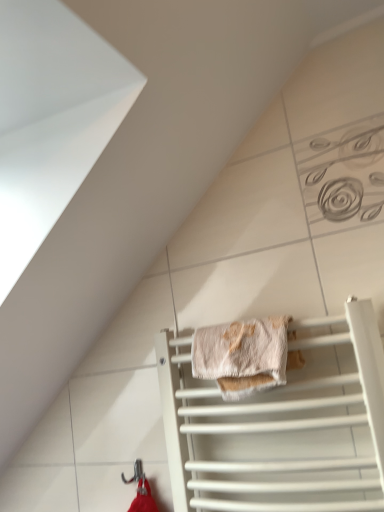
Question: Can you confirm if metallic hook at lower center is positioned to the left of beige textured towel at center?

Choices:
 (A) yes
 (B) no

Answer: (A)

Question: Considering the relative positions of metallic hook at lower center and beige textured towel at center in the image provided, is metallic hook at lower center to the right of beige textured towel at center from the viewer's perspective?

Choices:
 (A) no
 (B) yes

Answer: (A)

Question: From a real-world perspective, is metallic hook at lower center on beige textured towel at center?

Choices:
 (A) no
 (B) yes

Answer: (A)

Question: Does metallic hook at lower center have a lesser height compared to beige textured towel at center?

Choices:
 (A) no
 (B) yes

Answer: (B)

Question: Considering the relative sizes of metallic hook at lower center and beige textured towel at center in the image provided, is metallic hook at lower center smaller than beige textured towel at center?

Choices:
 (A) no
 (B) yes

Answer: (B)

Question: Can you confirm if metallic hook at lower center is bigger than beige textured towel at center?

Choices:
 (A) no
 (B) yes

Answer: (A)

Question: From the image's perspective, is beige textured towel at center located beneath white matte towel rack at lower center?

Choices:
 (A) yes
 (B) no

Answer: (B)

Question: Would you say beige textured towel at center is a long distance from white matte towel rack at lower center?

Choices:
 (A) yes
 (B) no

Answer: (B)

Question: Does beige textured towel at center come behind white matte towel rack at lower center?

Choices:
 (A) no
 (B) yes

Answer: (B)

Question: Is beige textured towel at center directly adjacent to white matte towel rack at lower center?

Choices:
 (A) yes
 (B) no

Answer: (B)

Question: Is beige textured towel at center not inside white matte towel rack at lower center?

Choices:
 (A) yes
 (B) no

Answer: (B)

Question: Can you confirm if beige textured towel at center is thinner than white matte towel rack at lower center?

Choices:
 (A) no
 (B) yes

Answer: (A)

Question: Does white matte towel rack at lower center appear on the left side of beige textured towel at center?

Choices:
 (A) yes
 (B) no

Answer: (B)